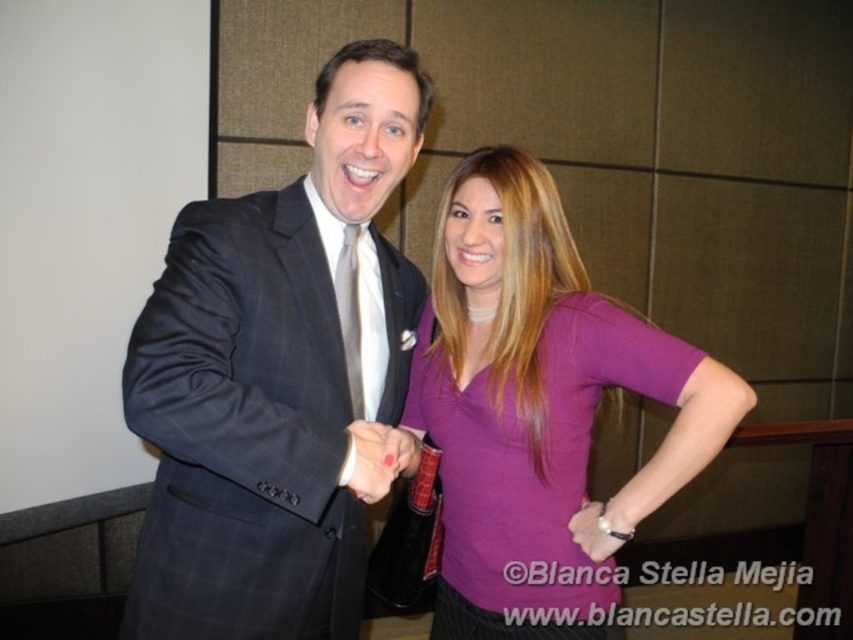
Question: Based on their relative distances, which object is farther from the purple matte shirt at center?

Choices:
 (A) matte purple shirt at center
 (B) white silk tie at center

Answer: (B)

Question: Which point is farther from the camera taking this photo?

Choices:
 (A) (361, 385)
 (B) (236, 506)
 (C) (589, 520)
 (D) (402, 433)

Answer: (C)

Question: Which object appears closest to the camera in this image?

Choices:
 (A) matte black hand at center
 (B) purple matte shirt at center

Answer: (A)

Question: Does white silk tie at center have a greater width compared to matte purple shirt at center?

Choices:
 (A) yes
 (B) no

Answer: (B)

Question: Is matte black suit at center closer to camera compared to dark blue plaid suit at center?

Choices:
 (A) yes
 (B) no

Answer: (B)

Question: Does dark blue plaid suit at center have a larger size compared to purple matte shirt at center?

Choices:
 (A) yes
 (B) no

Answer: (A)